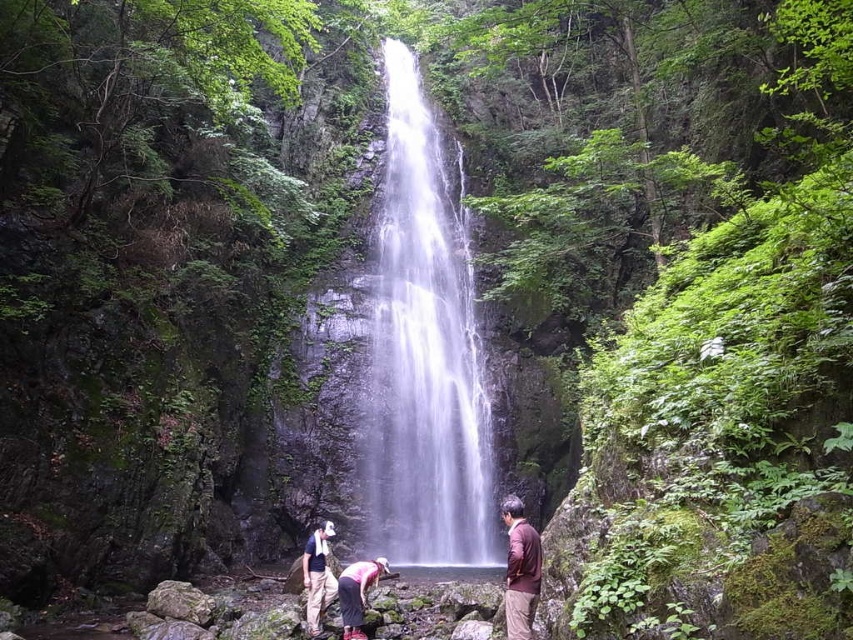
Is point (447, 236) farther from camera compared to point (322, 596)?

Yes, point (447, 236) is behind point (322, 596).

Does clear glass waterfall at center have a lesser width compared to dark brown leather jacket at lower center?

No.

Is point (469, 497) positioned before point (328, 531)?

No, (469, 497) is behind (328, 531).

Where is `clear glass waterfall at center`? clear glass waterfall at center is located at coordinates (422, 353).

Does dark brown leather jacket at lower center come in front of pink fabric pants at lower center?

No, it is behind pink fabric pants at lower center.

Is point (332, 588) positioned behind point (351, 566)?

Yes, point (332, 588) is behind point (351, 566).

Which is behind, point (315, 538) or point (352, 604)?

Point (315, 538)

Where is `dark brown leather jacket at lower center`? The width and height of the screenshot is (853, 640). dark brown leather jacket at lower center is located at coordinates (317, 577).

Is the position of brown matte shirt at center more distant than that of pink fabric pants at lower center?

No, brown matte shirt at center is closer to the viewer.

Does point (506, 593) lie in front of point (364, 572)?

Yes.

Find the location of a particular element. brown matte shirt at center is located at coordinates (520, 570).